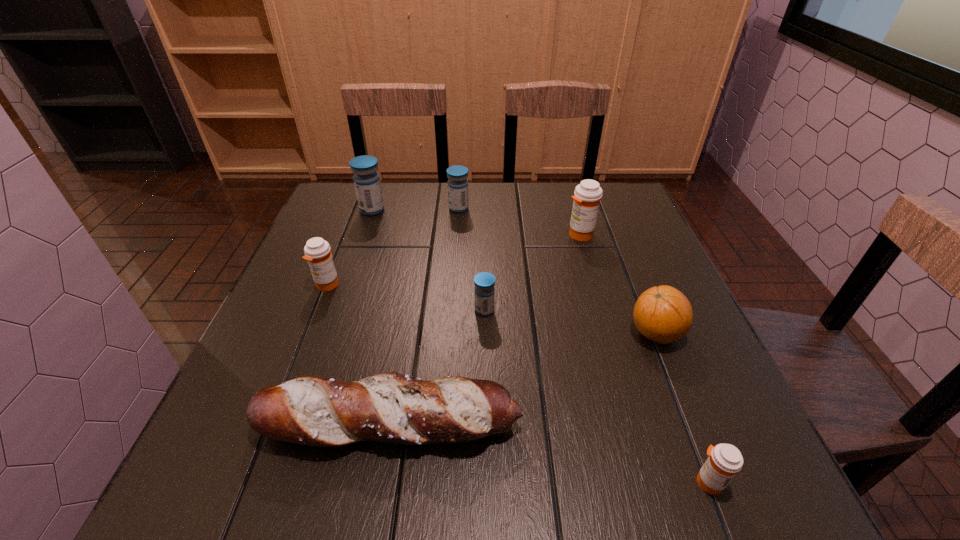
In order to click on vacant space located 0.300m on the back of the nearest medicine in this screenshot , I will do tap(648, 327).

What are the coordinates of `baguet located at the near edge` in the screenshot? It's located at (393, 408).

Where is `medicine that is positioned at the near edge`? The width and height of the screenshot is (960, 540). medicine that is positioned at the near edge is located at coordinates (725, 460).

Identify the location of baguet present at the left edge. Image resolution: width=960 pixels, height=540 pixels. (x=393, y=408).

I want to click on orange that is at the right edge, so click(663, 314).

The width and height of the screenshot is (960, 540). Identify the location of object at the far left corner. (366, 180).

Where is `object located at the near left corner`? object located at the near left corner is located at coordinates (393, 408).

Identify the location of object situated at the far right corner. (587, 195).

Where is `object at the near right corner`? object at the near right corner is located at coordinates (725, 460).

In the image, there is a desktop. Identify the location of vacant region at the far edge. The image size is (960, 540). (482, 213).